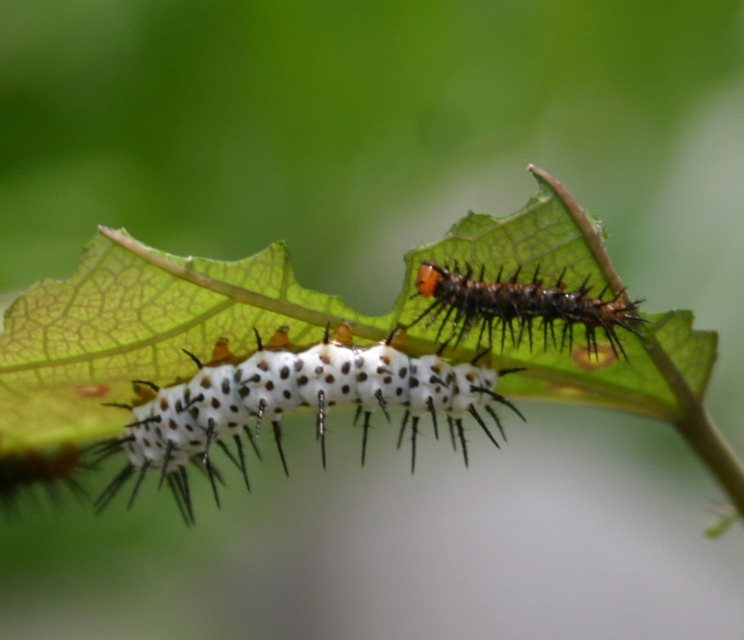
Question: Which point is farther from the camera taking this photo?

Choices:
 (A) click(x=551, y=339)
 (B) click(x=388, y=346)

Answer: (B)

Question: Is white spiny caterpillar at center thinner than orange spiny caterpillar at center?

Choices:
 (A) no
 (B) yes

Answer: (A)

Question: Observing the image, what is the correct spatial positioning of white spiny caterpillar at center in reference to orange spiny caterpillar at center?

Choices:
 (A) below
 (B) above

Answer: (A)

Question: Can you confirm if white spiny caterpillar at center is positioned below orange spiny caterpillar at center?

Choices:
 (A) no
 (B) yes

Answer: (B)